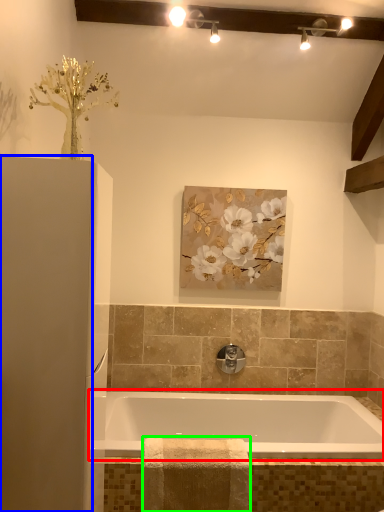
Question: Considering the real-world distances, which object is closest to bathtub (highlighted by a red box)? screen door (highlighted by a blue box) or material (highlighted by a green box).

Choices:
 (A) screen door
 (B) material

Answer: (B)